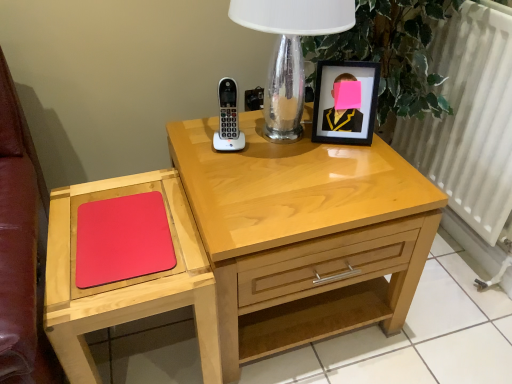
Identify the location of free spot behind white plastic phone at center. (239, 124).